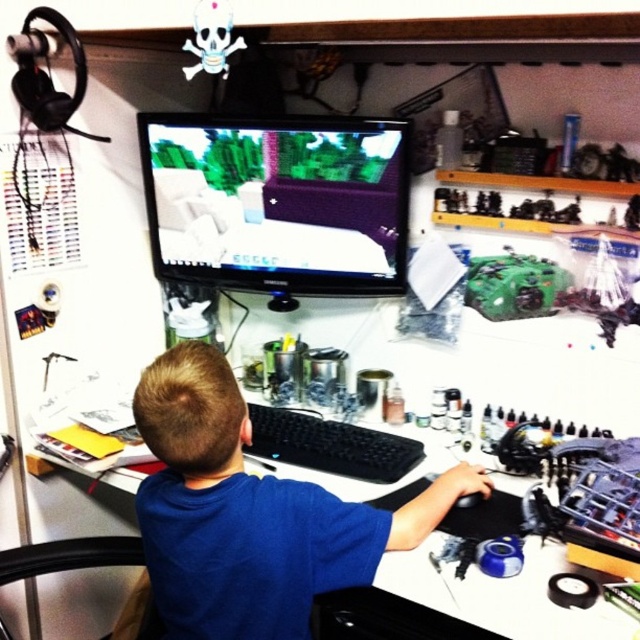
Can you confirm if black rubberized keyboard at center is positioned below black leather swivel chair at lower left?

No, black rubberized keyboard at center is not below black leather swivel chair at lower left.

Is black rubberized keyboard at center positioned before black leather swivel chair at lower left?

No, black rubberized keyboard at center is behind black leather swivel chair at lower left.

Who is more forward, (326, 449) or (67, 564)?

Point (67, 564) is more forward.

The height and width of the screenshot is (640, 640). Identify the location of black rubberized keyboard at center. (330, 445).

Does matte black monitor at center have a greater height compared to black rubberized keyboard at center?

Yes.

Is point (346, 275) positioned in front of point (337, 467)?

No, (346, 275) is further to viewer.

In order to click on matte black monitor at center in this screenshot , I will do `click(276, 202)`.

Does black rubberized keyboard at center appear on the left side of green plastic toy at center-right?

Indeed, black rubberized keyboard at center is positioned on the left side of green plastic toy at center-right.

Measure the distance between point (x=403, y=467) and camera.

Point (x=403, y=467) and camera are 1.39 meters apart.

Where is `black rubberized keyboard at center`? Image resolution: width=640 pixels, height=640 pixels. black rubberized keyboard at center is located at coordinates (330, 445).